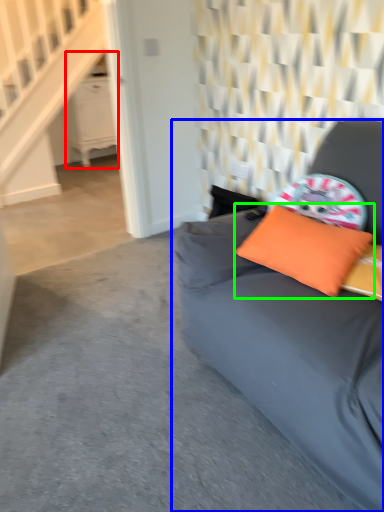
Question: Which object is the farthest from dresser (highlighted by a red box)? Choose among these: studio couch (highlighted by a blue box) or pillow (highlighted by a green box).

Choices:
 (A) studio couch
 (B) pillow

Answer: (B)